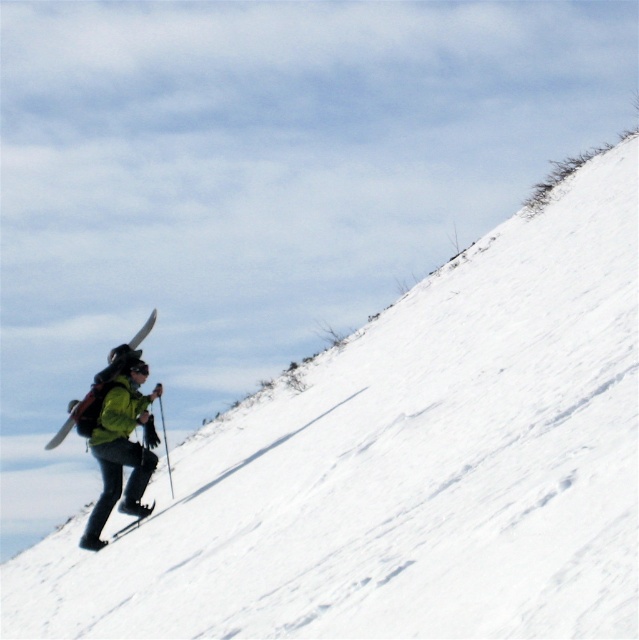
Question: Is green fabric jacket at lower left to the left of matte white ski at upper left from the viewer's perspective?

Choices:
 (A) no
 (B) yes

Answer: (A)

Question: Does green fabric jacket at lower left come in front of matte black ski at lower left?

Choices:
 (A) no
 (B) yes

Answer: (A)

Question: Estimate the real-world distances between objects in this image. Which object is farther from the matte white ski at upper left?

Choices:
 (A) green fabric jacket at lower left
 (B) matte black ski at lower left

Answer: (A)

Question: Considering the real-world distances, which object is farthest from the green fabric jacket at lower left?

Choices:
 (A) matte white ski at upper left
 (B) matte black ski at lower left

Answer: (A)

Question: Is matte white ski at upper left above matte black ski at lower left?

Choices:
 (A) no
 (B) yes

Answer: (B)

Question: Which is farther from the matte black ski at lower left?

Choices:
 (A) green fabric jacket at lower left
 (B) matte white ski at upper left

Answer: (B)